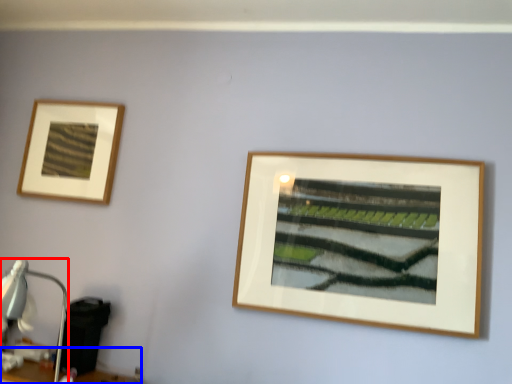
Question: Which of the following is the closest to the observer, table lamp (highlighted by a red box) or table (highlighted by a blue box)?

Choices:
 (A) table lamp
 (B) table

Answer: (A)